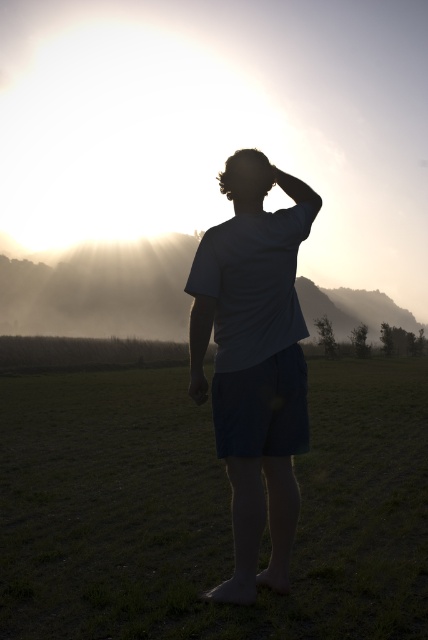
You are a photographer trying to capture the perfect shot of the person in the scene. You need to know the distance between the green grass at center and the gray cotton shirt at center to set up your camera. Can you tell me how far apart they are?

The green grass at center and the gray cotton shirt at center are 12.79 feet apart.

You are a photographer wanting to capture the scene with the green grass at center and the gray cotton shirt at center. Which object should you focus on if you want to emphasize the larger subject in your photo?

The green grass at center is larger in size than the gray cotton shirt at center, so focusing on the green grass at center would emphasize the larger subject in your photo.